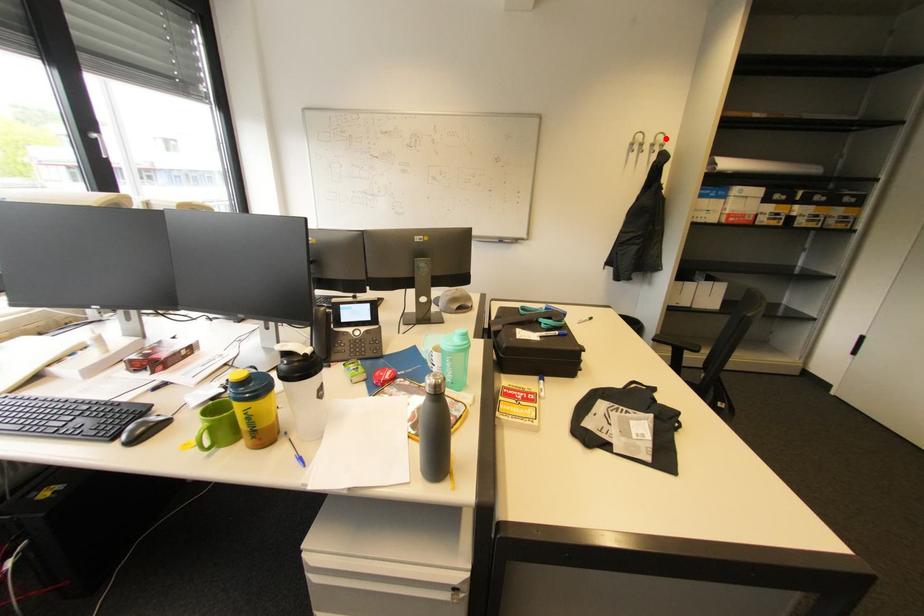
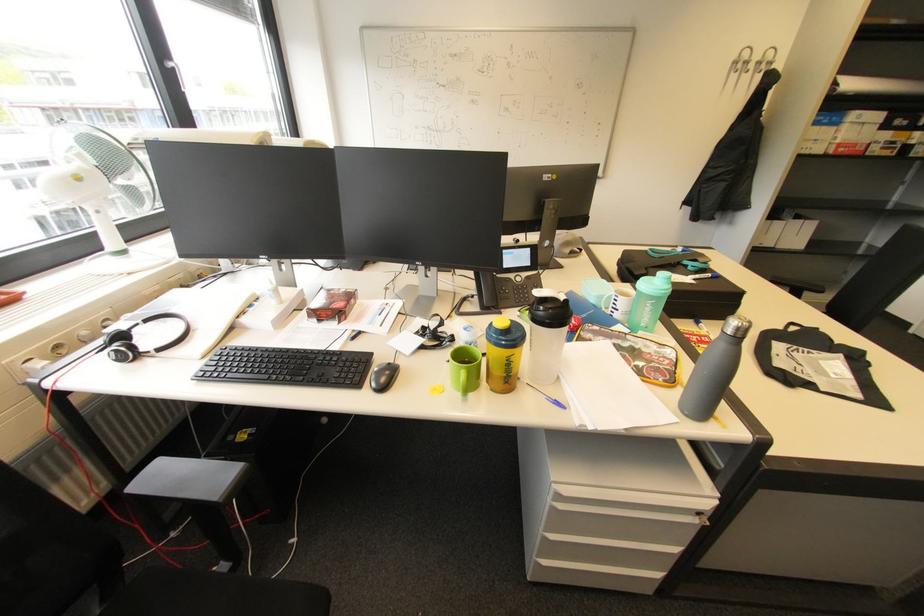
Question: I am providing you with two images of the same scene from different viewpoints. Given a red point in image1, look at the same physical point in image2. Is it:

Choices:
 (A) Closer to the viewpoint
 (B) Farther from the viewpoint

Answer: (B)